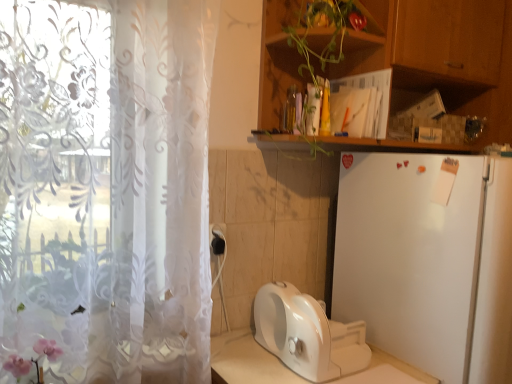
Question: Considering the relative positions of white glossy toaster at lower center and black plastic electric outlet at lower center in the image provided, is white glossy toaster at lower center to the left or to the right of black plastic electric outlet at lower center?

Choices:
 (A) right
 (B) left

Answer: (A)

Question: Is point (345, 355) positioned closer to the camera than point (224, 226)?

Choices:
 (A) closer
 (B) farther

Answer: (A)

Question: Which is farther from the white glossy toaster at lower center?

Choices:
 (A) white matte refrigerator at right
 (B) black plastic electric outlet at lower center
 (C) wooden cabinet at upper right
 (D) transparent floral curtain at left
 (E) pink floral decoration at lower left

Answer: (C)

Question: Based on their relative distances, which object is farther from the black plastic electric outlet at lower center?

Choices:
 (A) white matte refrigerator at right
 (B) white glossy toaster at lower center
 (C) wooden cabinet at upper right
 (D) pink floral decoration at lower left
 (E) transparent floral curtain at left

Answer: (C)